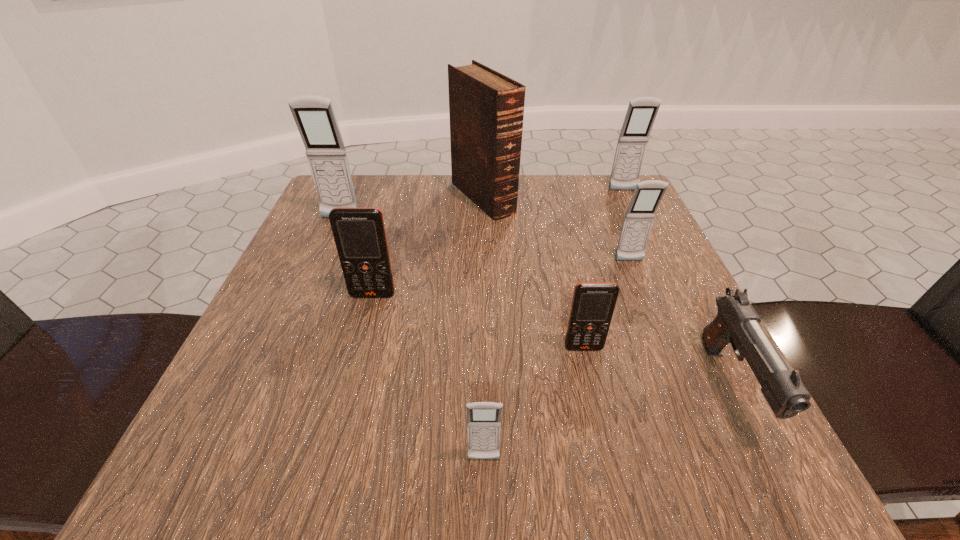
Where is `vacant space that is in between the gun and the third farthest cellular telephone`? This screenshot has height=540, width=960. vacant space that is in between the gun and the third farthest cellular telephone is located at coordinates (680, 323).

Identify the location of empty space between the second nearest cellular telephone and the nearest cellular telephone. The width and height of the screenshot is (960, 540). (534, 404).

This screenshot has height=540, width=960. Identify the location of the sixth closest object to the second gray cellular telephone from left to right. (314, 116).

Find the location of `object that is the second closest to the Bible`. object that is the second closest to the Bible is located at coordinates (647, 196).

Locate which cellular telephone is the third closest to the tallest cellular telephone. Please provide its 2D coordinates. Your answer should be formatted as a tuple, i.e. [(x, y)], where the tuple contains the x and y coordinates of a point satisfying the conditions above.

[(647, 196)]

Find the location of a particular element. the fourth closest cellular telephone to the fourth nearest cellular telephone is located at coordinates 483,418.

Select which gray cellular telephone is the second closest to the nearer orange cellular telephone. Please provide its 2D coordinates. Your answer should be formatted as a tuple, i.e. [(x, y)], where the tuple contains the x and y coordinates of a point satisfying the conditions above.

[(647, 196)]

At what (x,y) coordinates should I click in order to perform the action: click on gray cellular telephone identified as the fourth closest to the second object from left to right. Please return your answer as a coordinate pair (x, y). The width and height of the screenshot is (960, 540). Looking at the image, I should click on (641, 113).